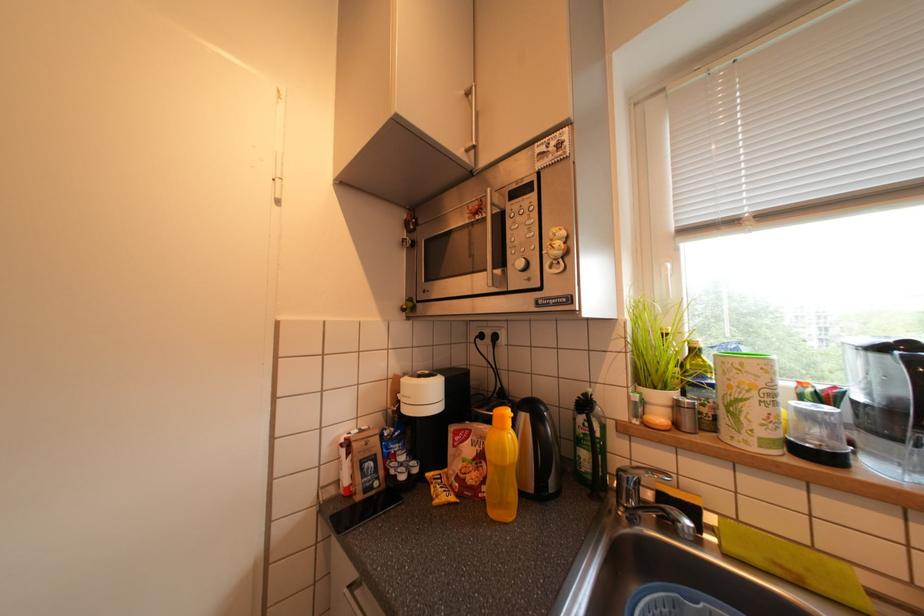
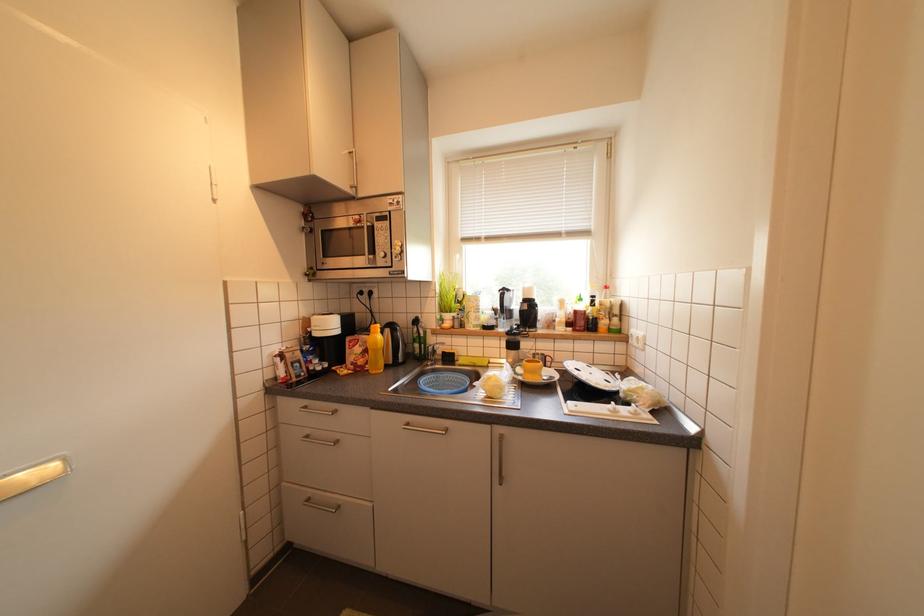
Question: The camera is either moving clockwise (left) or counter-clockwise (right) around the object. The first image is from the beginning of the video and the second image is from the end. Is the camera moving left or right when shooting the video?

Choices:
 (A) Left
 (B) Right

Answer: (A)